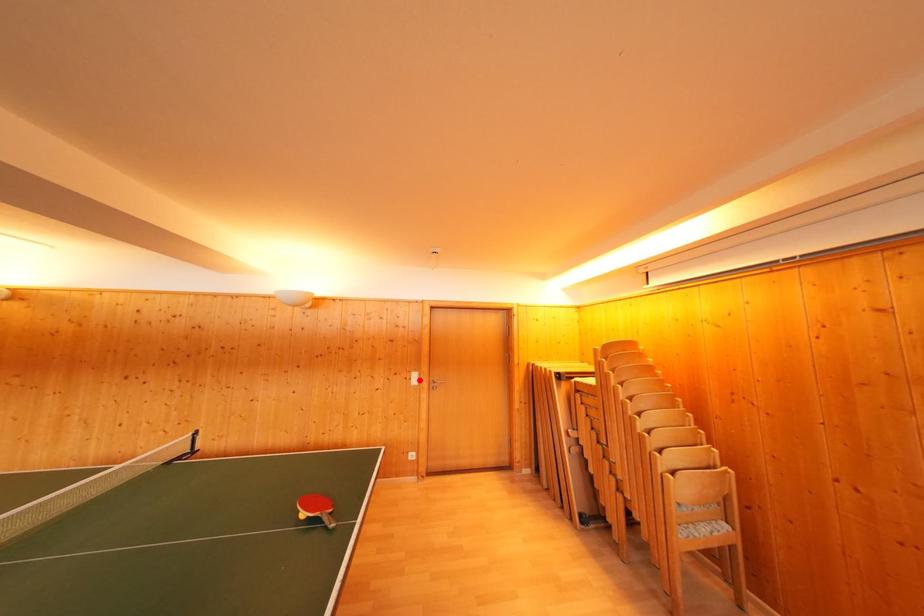
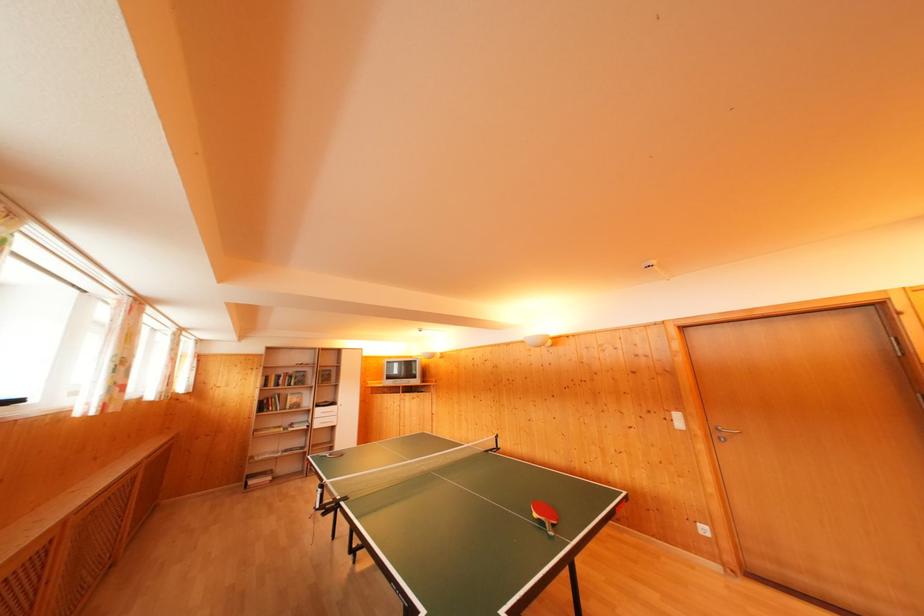
Question: A red point is marked in image1. In image2, is the corresponding 3D point closer to the camera or farther? Reply with the corresponding letter.

Choices:
 (A) The corresponding 3D point is closer.
 (B) The corresponding 3D point is farther.

Answer: (A)